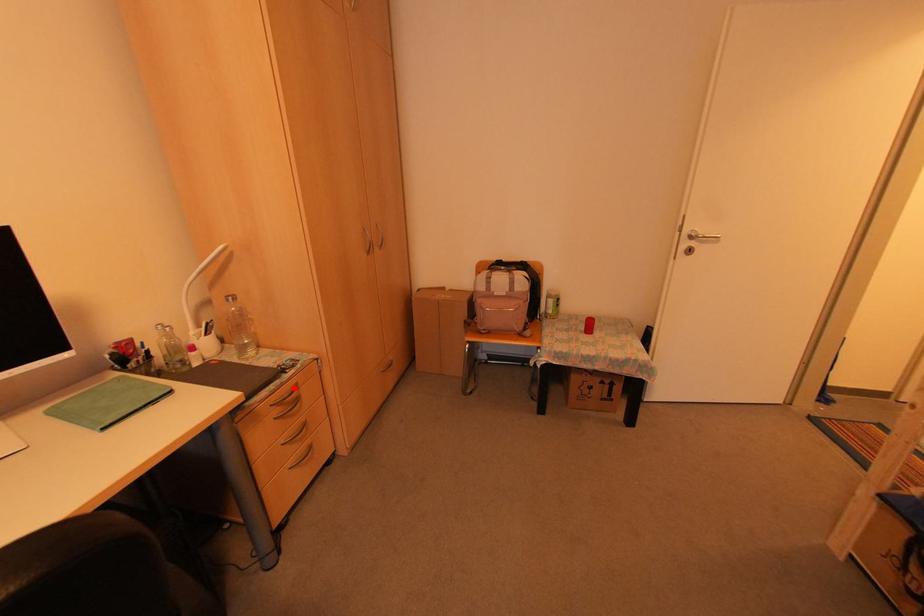
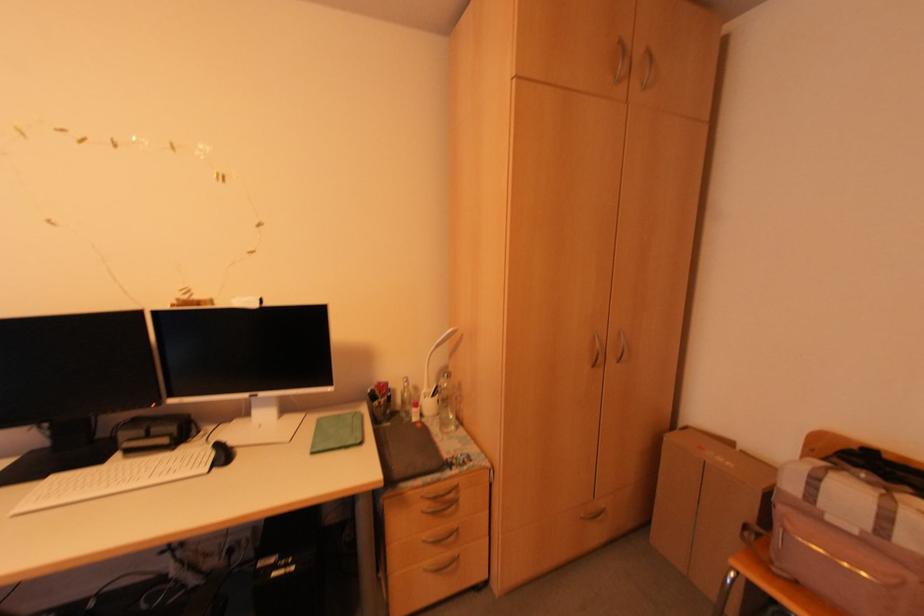
Question: I am providing you with two images of the same scene from different viewpoints. A red point is shown in image1. For the corresponding object point in image2, is it positioned nearer or farther from the camera?

Choices:
 (A) Nearer
 (B) Farther

Answer: (B)